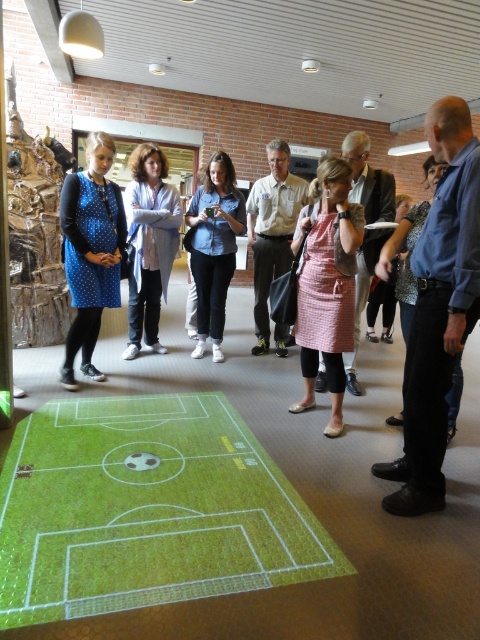
Question: Which object appears closest to the camera in this image?

Choices:
 (A) green textured carpet at center
 (B) blue shirt at right
 (C) pink checkered apron at center
 (D) blue dotted dress at left

Answer: (A)

Question: From the image, what is the correct spatial relationship of blue denim shirt at center in relation to black leather pants at right?

Choices:
 (A) below
 (B) above

Answer: (B)

Question: Is khaki uniform shirt at center to the right of black leather pants at right from the viewer's perspective?

Choices:
 (A) no
 (B) yes

Answer: (A)

Question: Which point is farther to the camera?

Choices:
 (A) (28, 445)
 (B) (439, 358)
 (C) (90, 282)
 (D) (208, 308)

Answer: (D)

Question: Among these objects, which one is nearest to the camera?

Choices:
 (A) blue denim shirt at center
 (B) khaki uniform shirt at center
 (C) blue dotted dress at left

Answer: (C)

Question: Is light blue shirt at center to the right of black leather pants at right from the viewer's perspective?

Choices:
 (A) yes
 (B) no

Answer: (B)